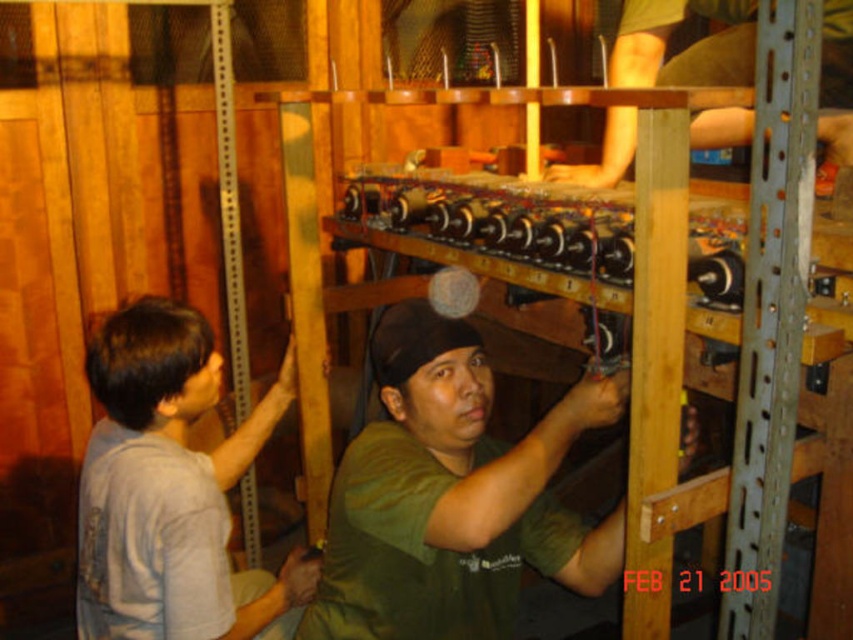
Question: Estimate the real-world distances between objects in this image. Which object is farther from the green matte shirt at upper center?

Choices:
 (A) gray cotton shirt at left
 (B) green matte shirt at center

Answer: (A)

Question: Is the position of green matte shirt at center less distant than that of green matte shirt at upper center?

Choices:
 (A) no
 (B) yes

Answer: (B)

Question: Which object is closer to the camera taking this photo?

Choices:
 (A) green matte shirt at center
 (B) green matte shirt at upper center
 (C) gray cotton shirt at left

Answer: (A)

Question: Is green matte shirt at center smaller than gray cotton shirt at left?

Choices:
 (A) no
 (B) yes

Answer: (B)

Question: Which is nearer to the green matte shirt at upper center?

Choices:
 (A) green matte shirt at center
 (B) gray cotton shirt at left

Answer: (A)

Question: Is green matte shirt at center to the left of gray cotton shirt at left from the viewer's perspective?

Choices:
 (A) yes
 (B) no

Answer: (B)